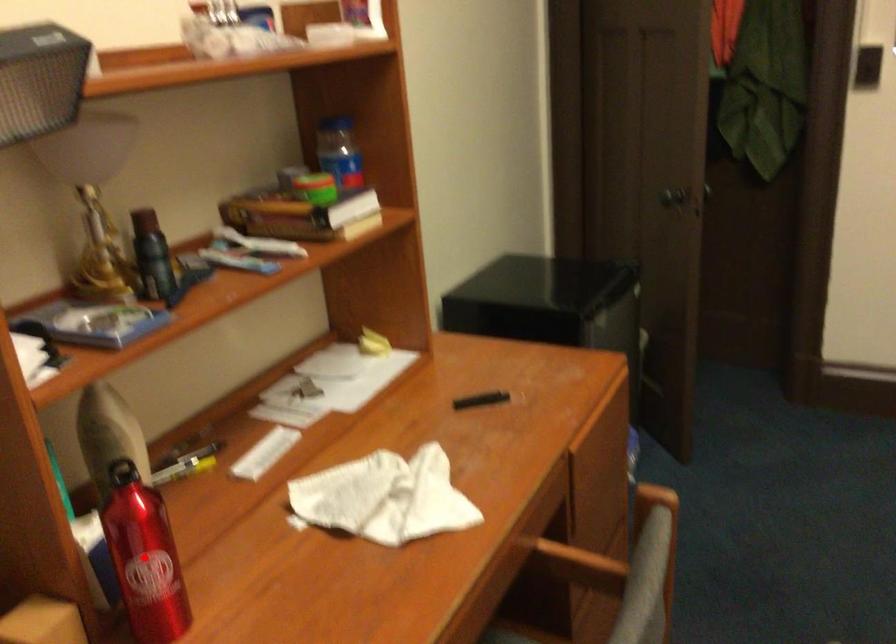
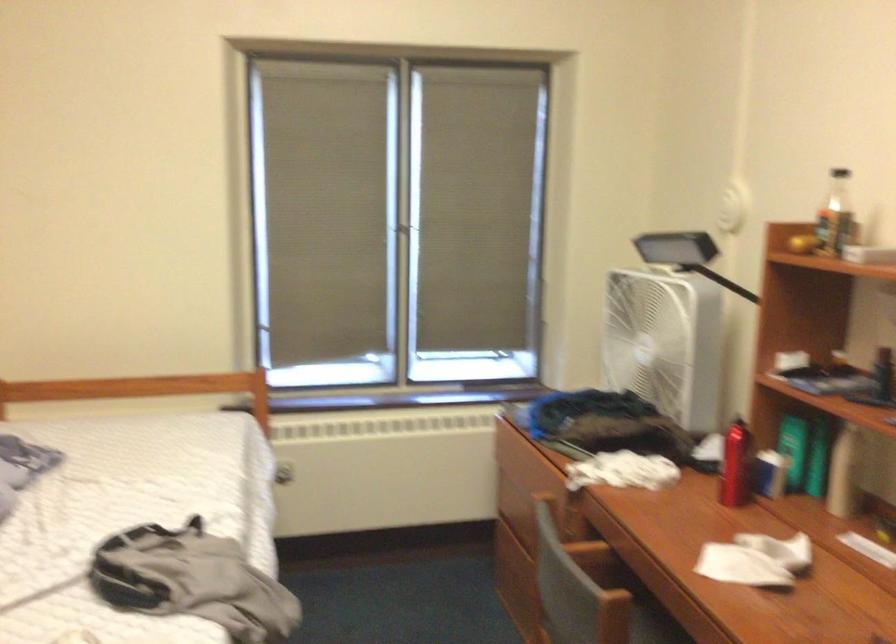
Question: I am providing you with two images of the same scene from different viewpoints. A red point is marked on the first image. Is the red point's position out of view in image 2?

Choices:
 (A) Yes
 (B) No

Answer: (A)